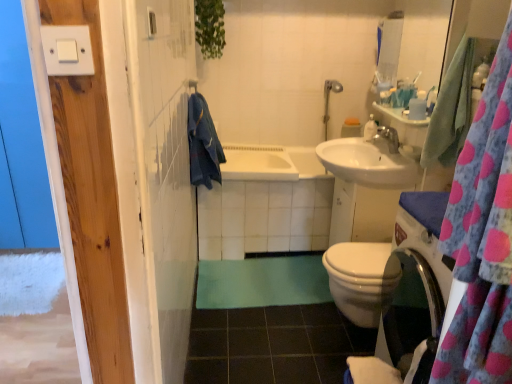
Question: Which direction should I rotate to face denim towel at center, acting as the 1th bath towel starting from the left, — up or down?

Choices:
 (A) down
 (B) up

Answer: (B)

Question: Does white ceramic bathtub at center, which ranks as the first bath in bottom-to-top order, appear on the left side of silver metallic shower head at upper right?

Choices:
 (A) no
 (B) yes

Answer: (B)

Question: From the image's perspective, is white ceramic bathtub at center, which appears as the 2th bath when viewed from the top, above silver metallic shower head at upper right?

Choices:
 (A) yes
 (B) no

Answer: (B)

Question: Is white ceramic bathtub at center, which ranks as the first bath in bottom-to-top order, outside silver metallic shower head at upper right?

Choices:
 (A) no
 (B) yes

Answer: (B)

Question: Is white ceramic bathtub at center, which ranks as the first bath in bottom-to-top order, facing towards silver metallic shower head at upper right?

Choices:
 (A) yes
 (B) no

Answer: (B)

Question: From a real-world perspective, is white ceramic bathtub at center, which appears as the 2th bath when viewed from the top, physically above silver metallic shower head at upper right?

Choices:
 (A) yes
 (B) no

Answer: (B)

Question: Does white ceramic bathtub at center, which ranks as the first bath in bottom-to-top order, have a lesser width compared to silver metallic shower head at upper right?

Choices:
 (A) no
 (B) yes

Answer: (A)

Question: Can you confirm if glossy ceramic mirror at upper right is positioned to the right of green rubber mat at lower center?

Choices:
 (A) no
 (B) yes

Answer: (B)

Question: From a real-world perspective, is glossy ceramic mirror at upper right located higher than green rubber mat at lower center?

Choices:
 (A) yes
 (B) no

Answer: (A)

Question: Does glossy ceramic mirror at upper right have a lesser width compared to green rubber mat at lower center?

Choices:
 (A) no
 (B) yes

Answer: (B)

Question: Is glossy ceramic mirror at upper right positioned with its back to green rubber mat at lower center?

Choices:
 (A) yes
 (B) no

Answer: (B)

Question: Is glossy ceramic mirror at upper right closer to camera compared to green rubber mat at lower center?

Choices:
 (A) no
 (B) yes

Answer: (A)

Question: Does glossy ceramic mirror at upper right turn towards green rubber mat at lower center?

Choices:
 (A) no
 (B) yes

Answer: (A)

Question: Considering the relative sizes of white glossy sink at center right and pink polka dot fabric at right in the image provided, is white glossy sink at center right smaller than pink polka dot fabric at right?

Choices:
 (A) no
 (B) yes

Answer: (A)